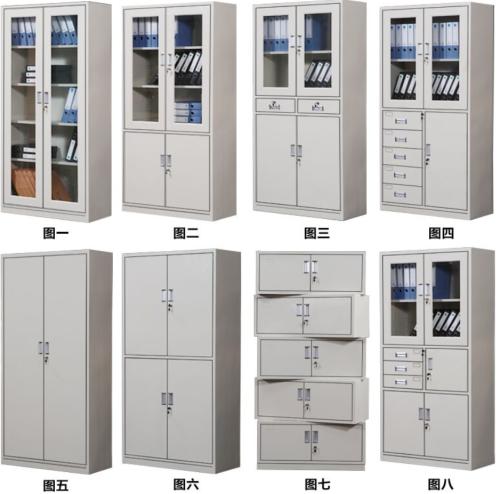
The image size is (500, 494). Find the location of `glass door , 3 drawer 2 wooded drawer cabinet bottom right`. glass door , 3 drawer 2 wooded drawer cabinet bottom right is located at coordinates (x=446, y=386).